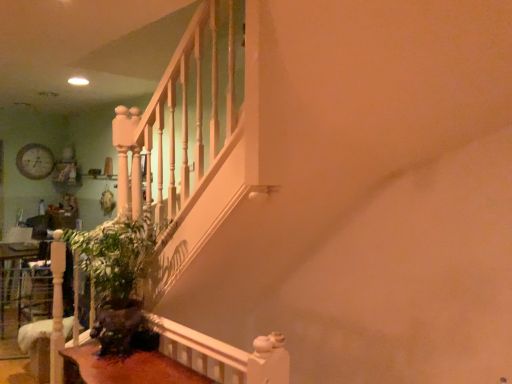
Where is `free space above brown wooden table at lower left (from a real-world perspective)`? The height and width of the screenshot is (384, 512). free space above brown wooden table at lower left (from a real-world perspective) is located at coordinates (120, 364).